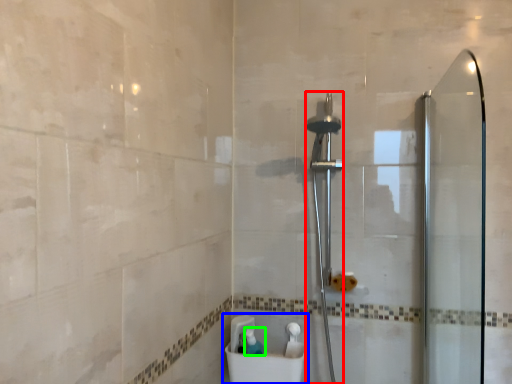
Question: Considering the real-world distances, which object is closest to shower (highlighted by a red box)? sink (highlighted by a blue box) or toiletry (highlighted by a green box).

Choices:
 (A) sink
 (B) toiletry

Answer: (A)